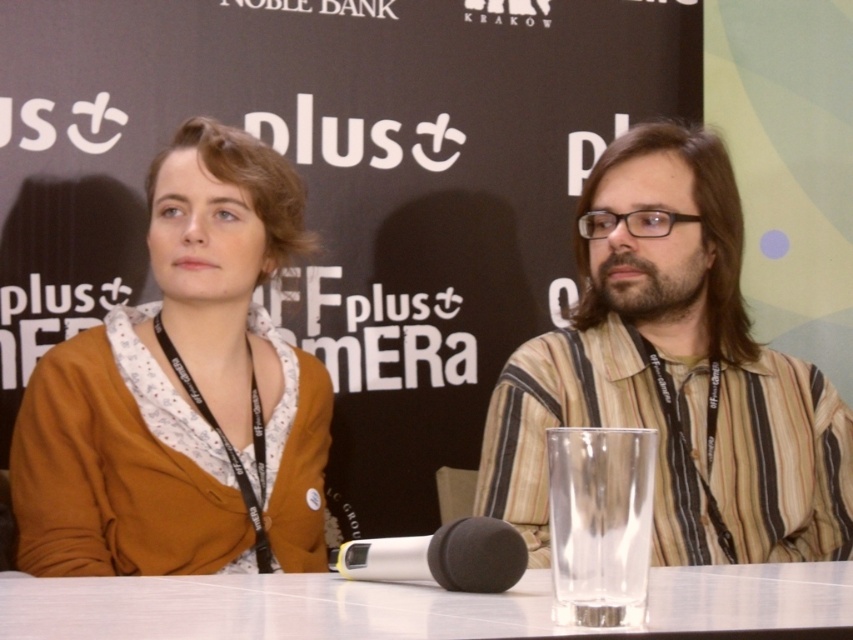
Question: Estimate the real-world distances between objects in this image. Which object is farther from the clear glass table at center?

Choices:
 (A) silver metallic microphone at center
 (B) striped cotton shirt at center
 (C) matte brown cardigan at center
 (D) matte black banner at center

Answer: (D)

Question: Which point is closer to the camera taking this photo?

Choices:
 (A) (378, 310)
 (B) (276, 358)
 (C) (341, 560)

Answer: (C)

Question: Is striped cotton shirt at center to the left of silver metallic microphone at center from the viewer's perspective?

Choices:
 (A) no
 (B) yes

Answer: (A)

Question: Does matte black banner at center have a larger size compared to clear glass table at center?

Choices:
 (A) yes
 (B) no

Answer: (A)

Question: Observing the image, what is the correct spatial positioning of matte black banner at center in reference to silver metallic microphone at center?

Choices:
 (A) below
 (B) above

Answer: (B)

Question: Estimate the real-world distances between objects in this image. Which object is farther from the matte brown cardigan at center?

Choices:
 (A) clear glass table at center
 (B) silver metallic microphone at center
 (C) matte black banner at center

Answer: (B)